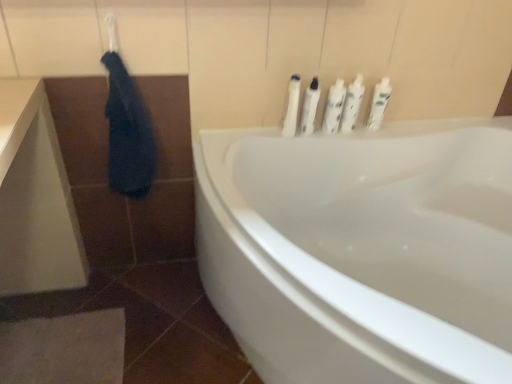
Locate an element on the screen. The height and width of the screenshot is (384, 512). vacant position to the left of white plastic bottles at upper center, which is the third toiletry in left-to-right order is located at coordinates click(291, 133).